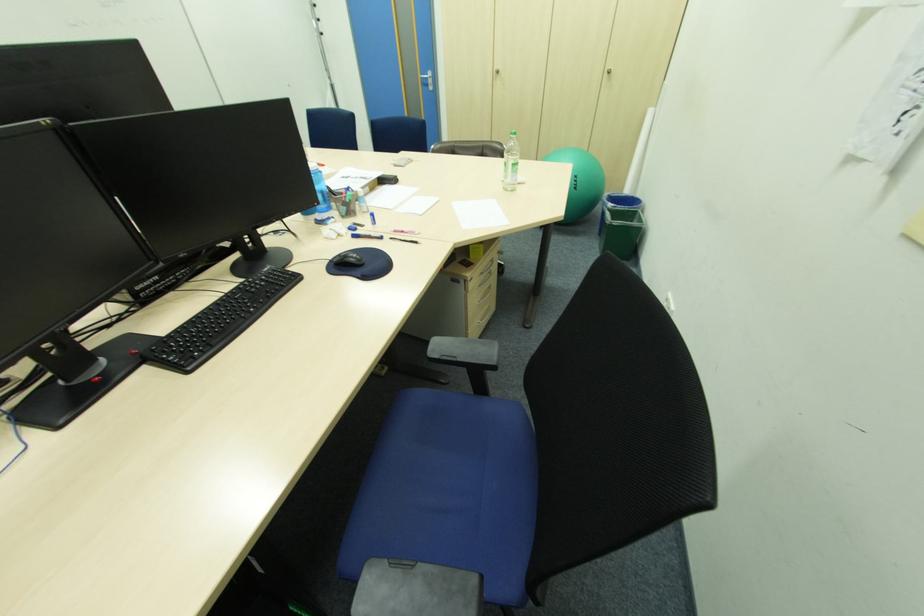
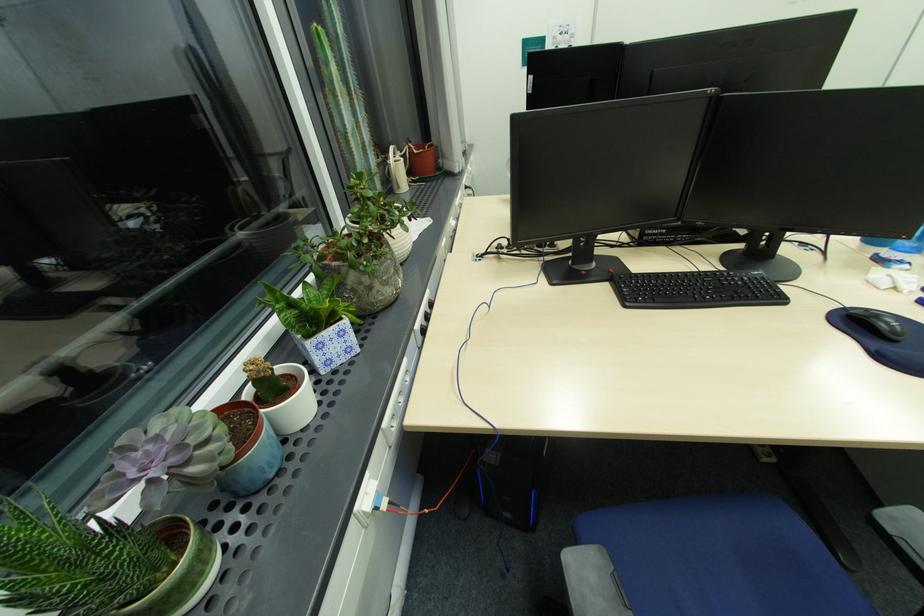
Where in the second image is the point corresponding to the point at 345,256 from the first image?

(872, 310)